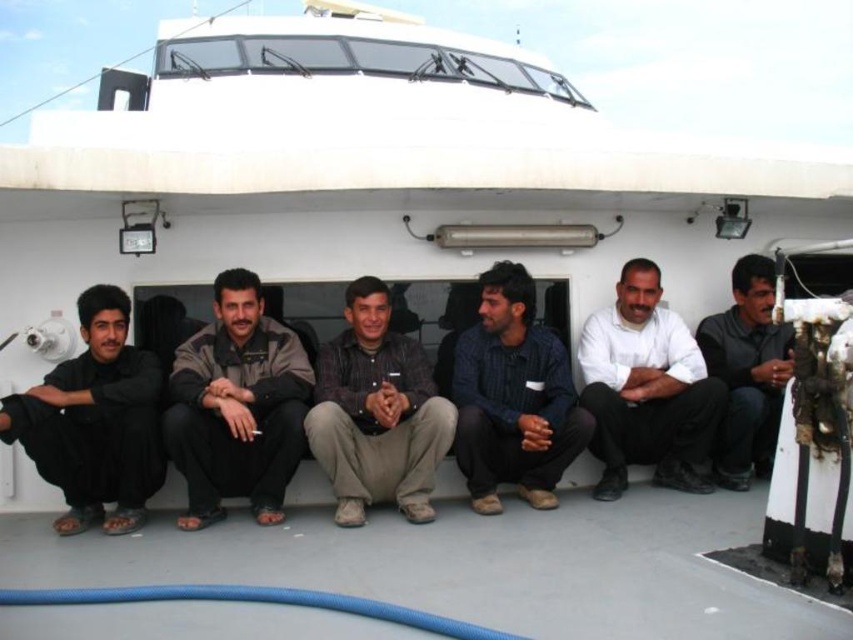
You are a photographer on the ship deck and want to ensure both the brown textured shirt at center and the black matte shirt at center are fully visible in your photo. Given their sizes, which one might require you to adjust your camera angle to avoid cropping?

The brown textured shirt at center is larger in size than the black matte shirt at center, so you might need to adjust your camera angle to ensure the larger brown textured shirt at center is fully visible without cropping.

You are a tailor who needs to determine which clothing item requires a wider workspace to lay out the fabric. Based on the image, which one is wider between the brown leather jacket at center and the black matte shirt at center?

The brown leather jacket at center is wider than the black matte shirt at center, so it requires a wider workspace to lay out the fabric.

You are standing on the deck of the ship and want to touch the point at coordinates (376,412). Which object on the deck are you closest to?

The point at coordinates (376,412) is on the brown textured shirt at center, so you are closest to the brown textured shirt at center.